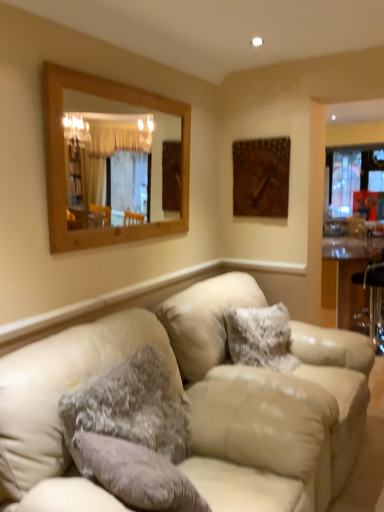
Question: From their relative heights in the image, would you say clear glass window at right is taller or shorter than wooden frame mirror at upper left?

Choices:
 (A) tall
 (B) short

Answer: (A)

Question: Is clear glass window at right in front of or behind wooden frame mirror at upper left in the image?

Choices:
 (A) behind
 (B) front

Answer: (A)

Question: Based on their relative distances, which object is nearer to the fuzzy gray pillow at center, the second pillow from the back?

Choices:
 (A) brown wooden picture frame at upper right
 (B) fuzzy fabric pillow at center, the 2th pillow viewed from the front
 (C) clear glass table at right
 (D) clear glass window at right
 (E) wooden frame mirror at upper left

Answer: (B)

Question: Which is farther from the wooden frame mirror at upper left?

Choices:
 (A) clear glass window at right
 (B) beige leather couch at center
 (C) fuzzy fabric pillow at center, which is the 1th pillow from back to front
 (D) brown wooden picture frame at upper right
 (E) clear glass table at right

Answer: (A)